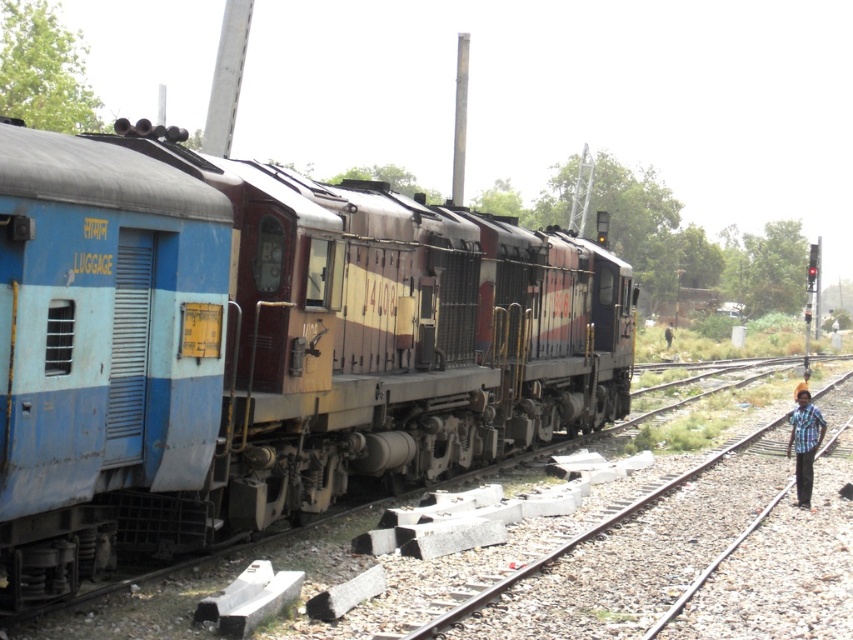
Question: Which point is closer to the camera?

Choices:
 (A) blue matte luggage at left
 (B) blue plaid shirt at right

Answer: (A)

Question: Observing the image, what is the correct spatial positioning of smooth metal train track at right in reference to blue plaid shirt at right?

Choices:
 (A) right
 (B) left

Answer: (A)

Question: Is smooth metal train track at right positioned at the back of blue plaid shirt at right?

Choices:
 (A) yes
 (B) no

Answer: (B)

Question: Which of the following is the closest to the observer?

Choices:
 (A) (521, 401)
 (B) (720, 458)
 (C) (813, 419)

Answer: (C)

Question: Among these points, which one is nearest to the camera?

Choices:
 (A) (805, 460)
 (B) (466, 600)

Answer: (B)

Question: Does smooth metal train track at right appear over blue plaid shirt at right?

Choices:
 (A) no
 (B) yes

Answer: (A)